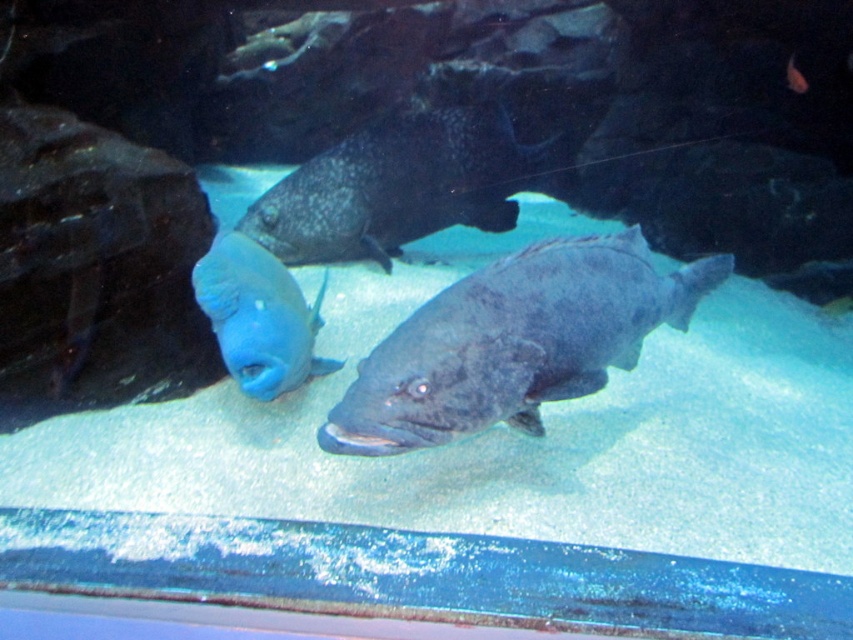
You are an underwater photographer aiming to capture both the dark gray textured fish at center and the matte blue fish at center in a single frame. Given their sizes, which fish should you focus on to ensure both fit comfortably in your camera frame?

The dark gray textured fish at center is larger than the matte blue fish at center, so you should focus on positioning the larger fish first to ensure both fit comfortably in the frame.